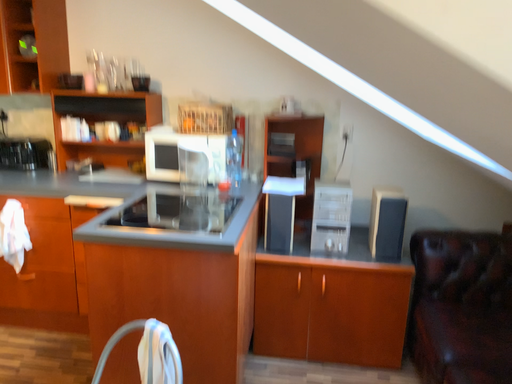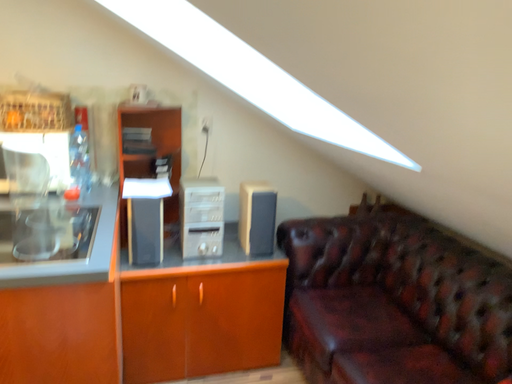
Question: How did the camera likely rotate when shooting the video?

Choices:
 (A) rotated right
 (B) rotated left

Answer: (A)